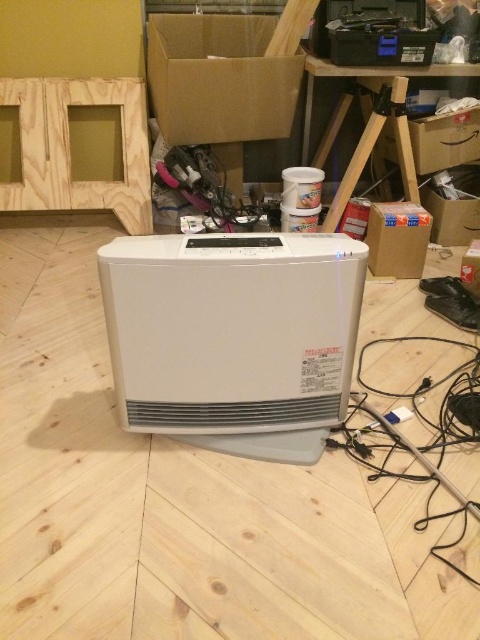
Question: Estimate the real-world distances between objects in this image. Which object is farther from the cardboard box at center?

Choices:
 (A) brown cardboard box at upper center
 (B) black cable at lower right
 (C) white plastic heater at center

Answer: (A)

Question: Where is white plastic heater at center located in relation to brown cardboard box at right in the image?

Choices:
 (A) right
 (B) left

Answer: (B)

Question: Is brown cardboard box at upper center smaller than cardboard box at center?

Choices:
 (A) no
 (B) yes

Answer: (A)

Question: Among these objects, which one is nearest to the camera?

Choices:
 (A) brown cardboard box at right
 (B) black cable at lower right

Answer: (B)

Question: Which object is the closest to the brown cardboard box at upper center?

Choices:
 (A) cardboard box at center
 (B) white plastic heater at center
 (C) brown cardboard box at right

Answer: (C)

Question: Does white plastic heater at center have a lesser width compared to brown cardboard box at upper center?

Choices:
 (A) no
 (B) yes

Answer: (B)